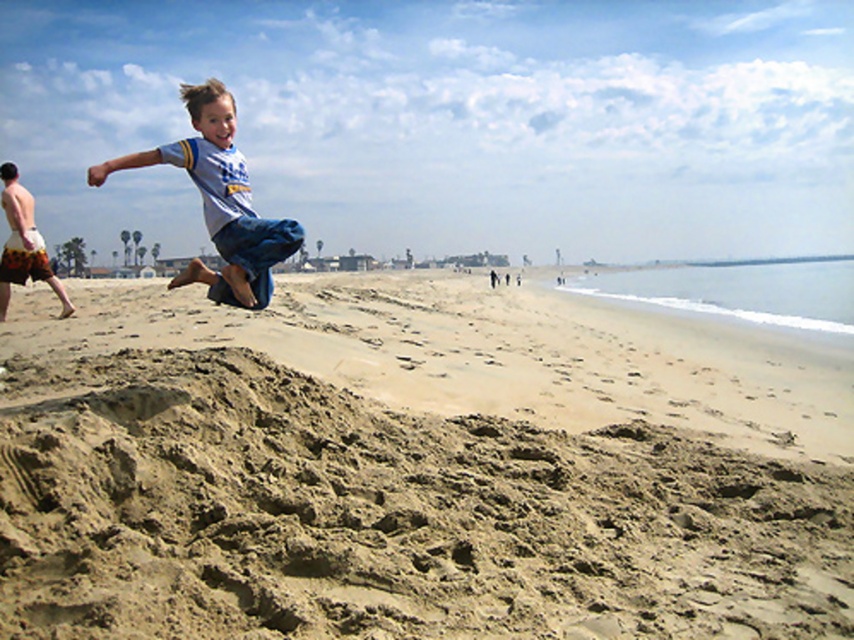
You are a photographer trying to capture the boy jumping off the sand dune. You want to make sure the fine sand at center and the light blue denim shorts at center are both clearly visible in your shot. Based on their positions, which object should you focus on first to ensure both are in focus?

The fine sand at center is in front of the light blue denim shorts at center. To ensure both are in focus, you should focus on the fine sand at center first since it is closer to the camera, allowing the background object to also be in focus if within the depth of field.

You are standing at the point labeled point (x=180, y=161) on the beach. You want to walk to the point labeled point (x=468, y=330). Which direction should you move in relation to the beach scene?

Point (x=468, y=330) is behind point (x=180, y=161), so you should move towards the back of the beach scene to reach it.

You are a photographer trying to capture the perfect shot of the beach scene. You notice the fine sand at center and the light blue denim shorts at center. Which object is positioned more to the left in the image?

The fine sand at center is to the left of the light blue denim shorts at center.